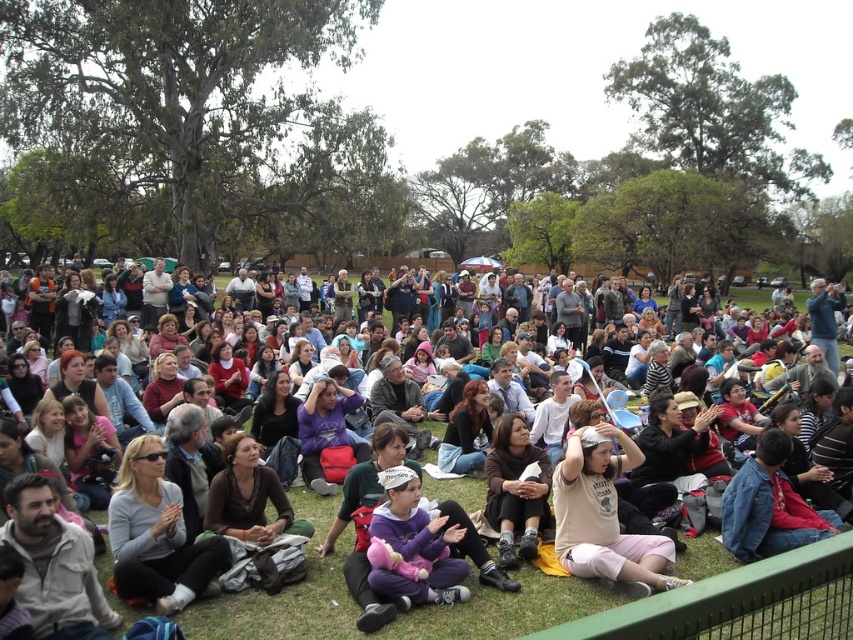
Question: From the image, what is the correct spatial relationship of light pink cotton pants at center in relation to dark brown hair at center?

Choices:
 (A) right
 (B) left

Answer: (A)

Question: Among these points, which one is nearest to the camera?

Choices:
 (A) (347, 538)
 (B) (129, 468)
 (C) (659, 536)
 (D) (521, 515)

Answer: (B)

Question: Estimate the real-world distances between objects in this image. Which object is closer to the dark brown hair at center?

Choices:
 (A) light pink cotton pants at center
 (B) matte black jacket at center

Answer: (A)

Question: Is light pink cotton pants at center above dark brown hair at center?

Choices:
 (A) yes
 (B) no

Answer: (B)

Question: Is matte black jacket at center wider than light pink cotton pants at center?

Choices:
 (A) no
 (B) yes

Answer: (B)

Question: Which point is closer to the camera?

Choices:
 (A) matte black sunglasses at center
 (B) matte black jacket at center
 (C) light pink cotton pants at center
 (D) dark brown hair at center

Answer: (B)